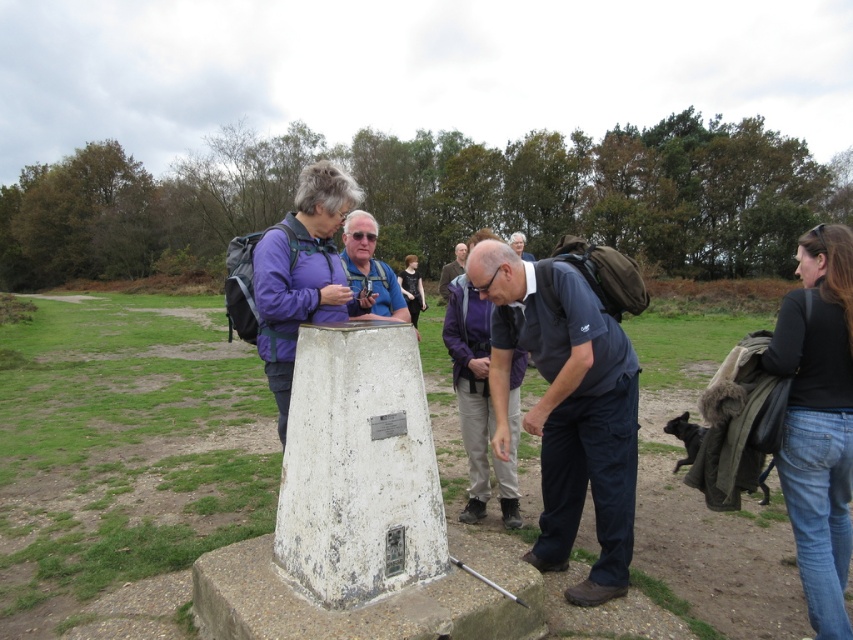
You are a photographer trying to capture a group photo of the people around the monument. You want to ensure both the dark blue fabric shirt at center and the black denim jeans at lower right are visible in the frame. Based on their positions, which direction should you position yourself relative to the monument to include both in the shot?

Since the dark blue fabric shirt at center is positioned on the left side of black denim jeans at lower right, you should position yourself to the right of the monument to ensure both the dark blue fabric shirt at center and the black denim jeans at lower right are visible in the frame.

Looking at this image, you are a hiker trying to locate the purple fabric jacket at center and the matte gray helmet at center in the scene. Based on their positions, which object is closer to the ground?

The purple fabric jacket at center is located below the matte gray helmet at center, so the purple fabric jacket at center is closer to the ground.